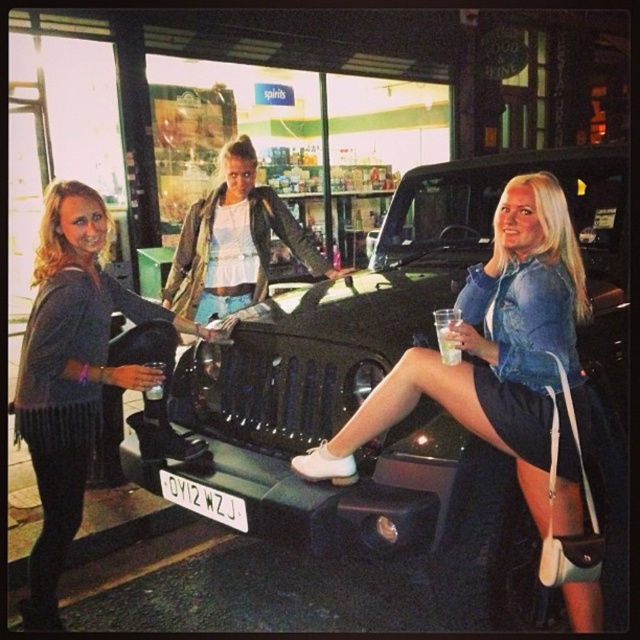
Does black matte car at center appear on the right side of clear plastic cup at center?

Indeed, black matte car at center is positioned on the right side of clear plastic cup at center.

Is black matte car at center below clear plastic cup at center?

Yes.

Measure the distance between point (433, 520) and camera.

8.51 feet

I want to click on black matte car at center, so click(x=420, y=401).

Is black matte car at center smaller than clear plastic bottle at center?

No, black matte car at center is not smaller than clear plastic bottle at center.

Between black matte car at center and clear plastic bottle at center, which one has less height?

With less height is clear plastic bottle at center.

Between point (326, 374) and point (150, 400), which one is positioned in front?

Positioned in front is point (326, 374).

Image resolution: width=640 pixels, height=640 pixels. What are the coordinates of `black matte car at center` in the screenshot? It's located at (420, 401).

Does matte black jacket at left have a larger size compared to clear plastic bottle at center?

Yes.

Who is more distant from viewer, (104, 216) or (145, 406)?

Point (145, 406)

The width and height of the screenshot is (640, 640). I want to click on matte black jacket at left, so pyautogui.click(x=70, y=374).